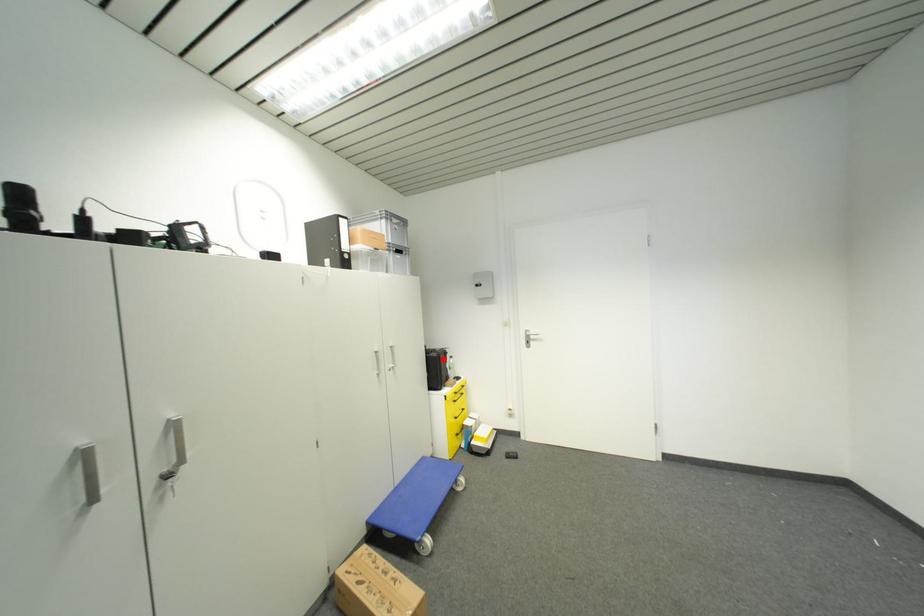
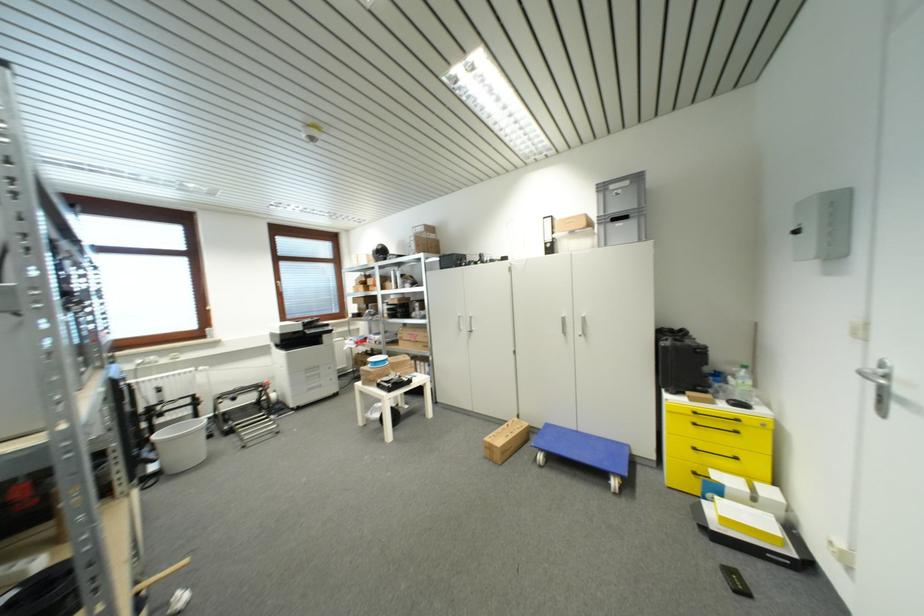
Question: I am providing you with two images of the same scene from different viewpoints. A red point is marked on the first image. Can you still see the location of the red point in image 2?

Choices:
 (A) Yes
 (B) No

Answer: (A)